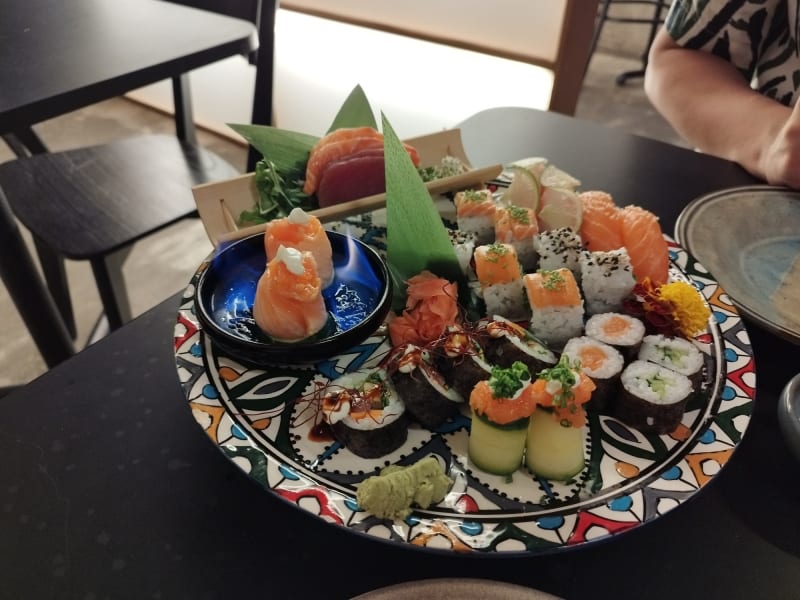
What are the coordinates of `chair` in the screenshot? It's located at (130, 157).